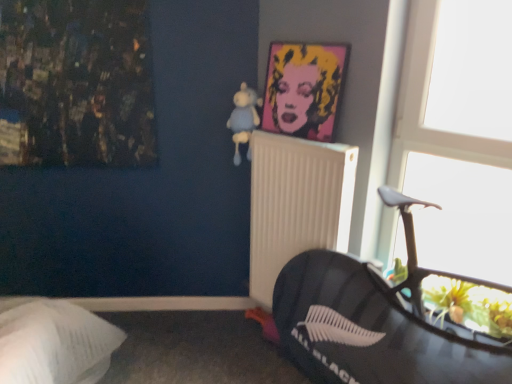
What do you see at coordinates (304, 89) in the screenshot? I see `pop art portrait at upper center` at bounding box center [304, 89].

Locate an element on the screen. This screenshot has height=384, width=512. pop art portrait at upper center is located at coordinates [x=304, y=89].

Are light blue plush at upper center and pop art portrait at upper center located far from each other?

No, there isn't a large distance between light blue plush at upper center and pop art portrait at upper center.

How different are the orientations of light blue plush at upper center and pop art portrait at upper center in degrees?

light blue plush at upper center and pop art portrait at upper center are facing 7.51 degrees away from each other.

In the image, there is a pop art portrait at upper center. Identify the location of toy below it (from the image's perspective). This screenshot has height=384, width=512. (244, 119).

From a real-world perspective, is light blue plush at upper center above or below pop art portrait at upper center?

light blue plush at upper center is situated lower than pop art portrait at upper center in the real world.

Is white plastic radiator at center looking in the opposite direction of light blue plush at upper center?

white plastic radiator at center does not have its back to light blue plush at upper center.

Can you confirm if white plastic radiator at center is thinner than light blue plush at upper center?

Yes, white plastic radiator at center is thinner than light blue plush at upper center.

Is point (334, 238) positioned before point (239, 105)?

Yes, it is.

This screenshot has width=512, height=384. I want to click on radiator behind the pop art portrait at upper center, so click(x=296, y=203).

Can you tell me how much pop art portrait at upper center and white plastic radiator at center differ in facing direction?

The facing directions of pop art portrait at upper center and white plastic radiator at center are 1.07 degrees apart.

Is pop art portrait at upper center oriented away from white plastic radiator at center?

pop art portrait at upper center is not turned away from white plastic radiator at center.

From a real-world perspective, is pop art portrait at upper center located higher than white plastic radiator at center?

Yes, from a real-world perspective, pop art portrait at upper center is on top of white plastic radiator at center.

Do you think white plastic radiator at center is within pop art portrait at upper center, or outside of it?

white plastic radiator at center lies outside pop art portrait at upper center.

Based on the photo, which is more to the left, white plastic radiator at center or pop art portrait at upper center?

From the viewer's perspective, white plastic radiator at center appears more on the left side.

The height and width of the screenshot is (384, 512). In order to click on radiator below the pop art portrait at upper center (from the image's perspective) in this screenshot , I will do `click(296, 203)`.

In the scene shown: From the image's perspective, is light blue plush at upper center located above or below white plastic radiator at center?

light blue plush at upper center is above white plastic radiator at center.

Is light blue plush at upper center looking in the opposite direction of white plastic radiator at center?

light blue plush at upper center is not turned away from white plastic radiator at center.

Is light blue plush at upper center far away from white plastic radiator at center?

They are positioned close to each other.

Between pop art portrait at upper center and light blue plush at upper center, which one has less height?

Standing shorter between the two is light blue plush at upper center.

Can you tell me how much pop art portrait at upper center and light blue plush at upper center differ in facing direction?

They differ by 7.51 degrees in their facing directions.

At what (x,y) coordinates should I click in order to perform the action: click on toy lying below the pop art portrait at upper center (from the image's perspective). Please return your answer as a coordinate pair (x, y). The width and height of the screenshot is (512, 384). Looking at the image, I should click on (244, 119).

I want to click on toy that appears behind the pop art portrait at upper center, so click(x=244, y=119).

I want to click on toy on the left of white plastic radiator at center, so coord(244,119).

When comparing their distances from white plastic radiator at center, does pop art portrait at upper center or light blue plush at upper center seem closer?

Among the two, pop art portrait at upper center is located nearer to white plastic radiator at center.

In the scene shown: Which object lies nearer to the anchor point light blue plush at upper center, white plastic radiator at center or pop art portrait at upper center?

pop art portrait at upper center.

Looking at this image, from the image, which object appears to be nearer to pop art portrait at upper center, white plastic radiator at center or light blue plush at upper center?

light blue plush at upper center is closer to pop art portrait at upper center.

Looking at the image, which one is located closer to light blue plush at upper center, pop art portrait at upper center or white plastic radiator at center?

Based on the image, pop art portrait at upper center appears to be nearer to light blue plush at upper center.

Which object lies further to the anchor point white plastic radiator at center, light blue plush at upper center or pop art portrait at upper center?

Based on the image, light blue plush at upper center appears to be further to white plastic radiator at center.

Based on their spatial positions, is light blue plush at upper center or white plastic radiator at center further from pop art portrait at upper center?

white plastic radiator at center.

Where is `toy that lies between pop art portrait at upper center and white plastic radiator at center from top to bottom`? toy that lies between pop art portrait at upper center and white plastic radiator at center from top to bottom is located at coordinates (244, 119).